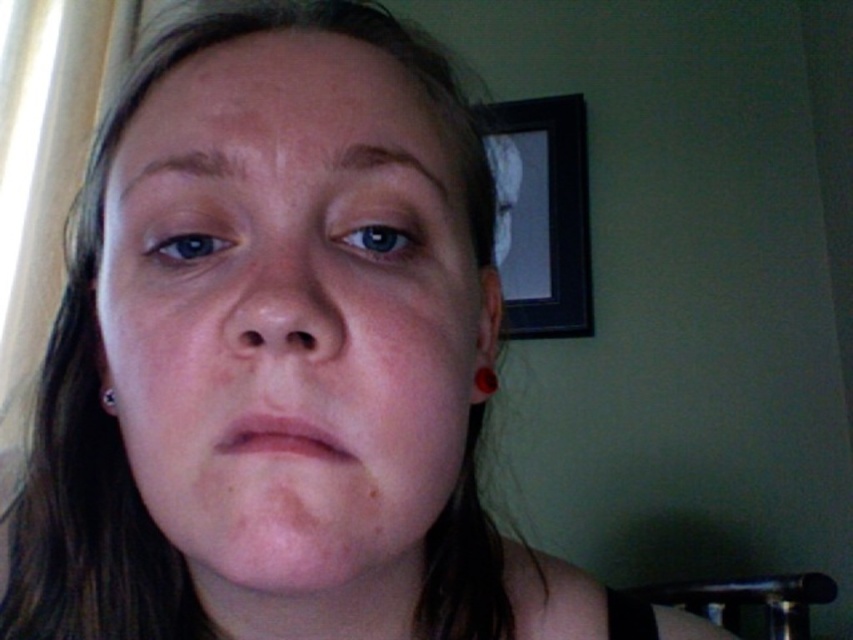
Question: Is black matte picture frame at upper right bigger than silver metallic earring at lower left?

Choices:
 (A) yes
 (B) no

Answer: (A)

Question: Which of these objects is positioned closest to the black matte picture frame at upper right?

Choices:
 (A) red glossy earring at lower left
 (B) silver metallic earring at lower left

Answer: (B)

Question: Which of the following is the farthest from the observer?

Choices:
 (A) [527, 323]
 (B) [479, 371]
 (C) [112, 404]
 (D) [109, 232]

Answer: (A)

Question: Where is smooth skin face at center located in relation to black matte picture frame at upper right in the image?

Choices:
 (A) above
 (B) below

Answer: (B)

Question: Can you confirm if smooth skin face at center is positioned to the left of black matte picture frame at upper right?

Choices:
 (A) no
 (B) yes

Answer: (B)

Question: Estimate the real-world distances between objects in this image. Which object is farther from the black matte picture frame at upper right?

Choices:
 (A) smooth skin face at center
 (B) red glossy earring at lower left
 (C) silver metallic earring at lower left

Answer: (B)